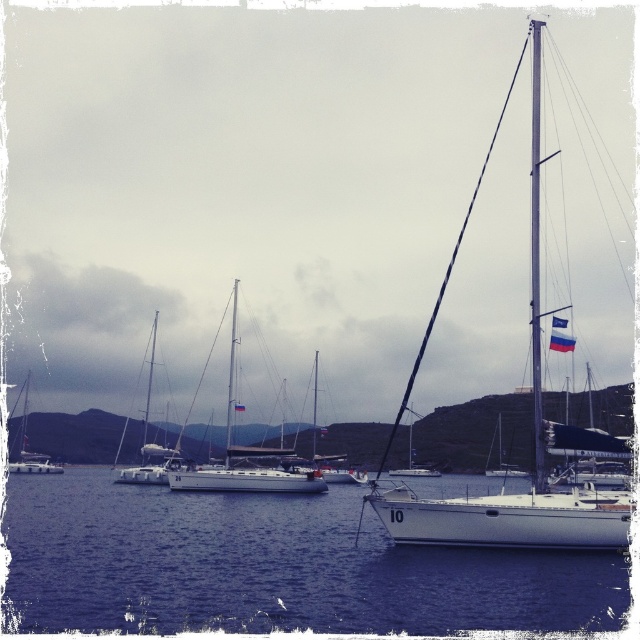
In the scene shown: Can you confirm if white glossy sailboat at center is thinner than silver/metallic mast at upper right?

Yes, white glossy sailboat at center is thinner than silver/metallic mast at upper right.

Between point (176, 484) and point (536, 298), which one is positioned in front?

Point (536, 298) is more forward.

In order to click on white glossy sailboat at center in this screenshot , I will do `click(244, 456)`.

Describe the element at coordinates (534, 456) in the screenshot. Image resolution: width=640 pixels, height=640 pixels. I see `white glossy sailboat at right` at that location.

Does white glossy sailboat at right have a smaller size compared to white matte sailboat at center?

No, white glossy sailboat at right is not smaller than white matte sailboat at center.

Find the location of a particular element. white glossy sailboat at right is located at coordinates (534, 456).

Is blue water at center wider than silver/metallic mast at upper right?

No.

Between blue water at center and silver/metallic mast at upper right, which one is positioned lower?

blue water at center

Between point (166, 536) and point (532, 173), which one is positioned in front?

Positioned in front is point (532, 173).

The width and height of the screenshot is (640, 640). I want to click on blue water at center, so click(x=273, y=566).